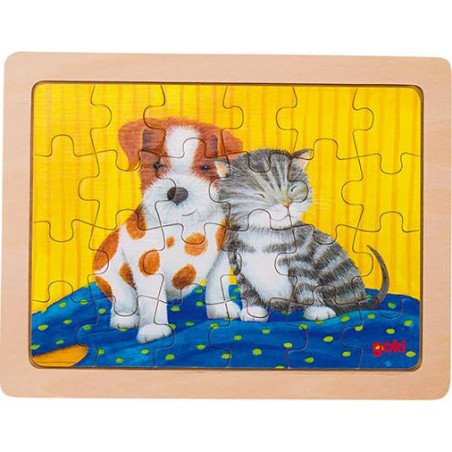
Where is `interior piece`? interior piece is located at coordinates (130, 268), (181, 258), (265, 270), (320, 261), (317, 203), (262, 188), (189, 188), (111, 194).